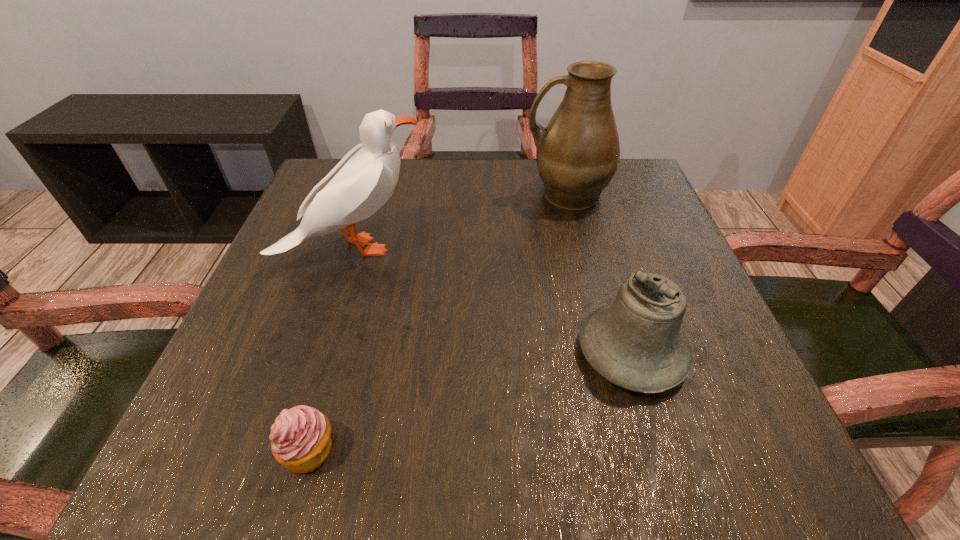
Locate an element on the screen. The height and width of the screenshot is (540, 960). free location located 0.160m on the left of the bell is located at coordinates (477, 353).

The image size is (960, 540). Find the location of `vacant area located 0.060m on the back of the cupcake`. vacant area located 0.060m on the back of the cupcake is located at coordinates (327, 386).

Locate an element on the screen. object situated at the far edge is located at coordinates (577, 154).

You are a GUI agent. You are given a task and a screenshot of the screen. Output one action in this format:
    pyautogui.click(x=<x>, y=<y>)
    Task: Click on the object located in the near edge section of the desktop
    Image resolution: width=960 pixels, height=540 pixels.
    Given the screenshot: What is the action you would take?
    pyautogui.click(x=300, y=438)

The height and width of the screenshot is (540, 960). What are the coordinates of `gull situated at the left edge` in the screenshot? It's located at (363, 181).

Locate an element on the screen. The height and width of the screenshot is (540, 960). cupcake situated at the left edge is located at coordinates (300, 438).

At what (x,y) coordinates should I click in order to perform the action: click on pitcher located at the right edge. Please return your answer as a coordinate pair (x, y). Looking at the image, I should click on (577, 154).

This screenshot has width=960, height=540. Identify the location of bell situated at the right edge. (636, 343).

This screenshot has width=960, height=540. Find the location of `object located in the near left corner section of the desktop`. object located in the near left corner section of the desktop is located at coordinates (300, 438).

The height and width of the screenshot is (540, 960). Identify the location of object that is at the far right corner. (577, 154).